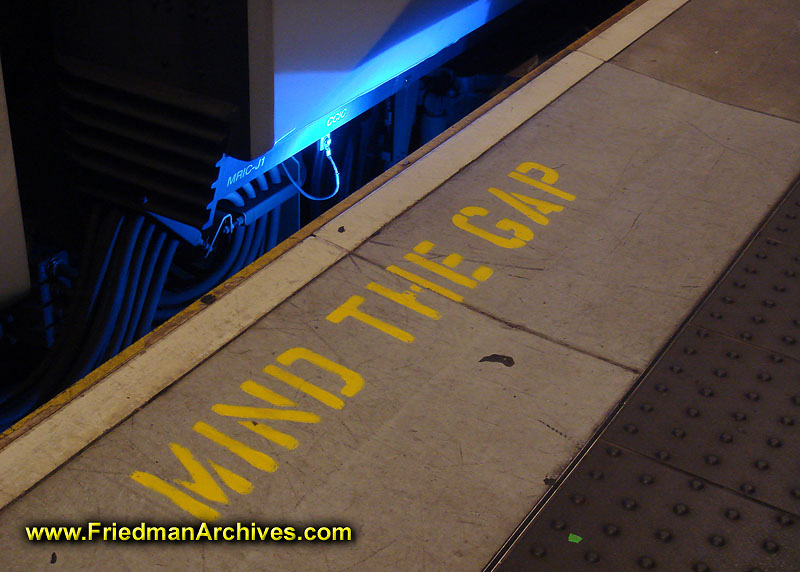
The image size is (800, 572). I want to click on right front table leg, so click(x=401, y=125).